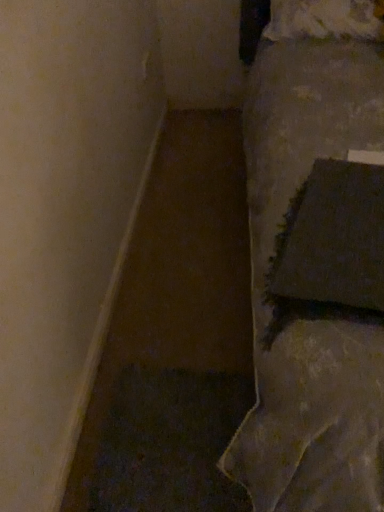
Question: Are white fluffy pillow at upper right, marked as the second pillow in a bottom-to-top arrangement, and dark fabric pillow at right, marked as the 1th pillow in a bottom-to-top arrangement, far apart?

Choices:
 (A) yes
 (B) no

Answer: (A)

Question: Is white fluffy pillow at upper right, which ranks as the 1th pillow in back-to-front order, positioned with its back to dark fabric pillow at right, the first pillow in the front-to-back sequence?

Choices:
 (A) no
 (B) yes

Answer: (A)

Question: Does white fluffy pillow at upper right, the 1th pillow positioned from the top, come behind dark fabric pillow at right, the second pillow in the back-to-front sequence?

Choices:
 (A) yes
 (B) no

Answer: (A)

Question: Is white fluffy pillow at upper right, the 1th pillow positioned from the top, aimed at dark fabric pillow at right, marked as the 1th pillow in a bottom-to-top arrangement?

Choices:
 (A) yes
 (B) no

Answer: (A)

Question: Considering the relative sizes of white fluffy pillow at upper right, which is the second pillow from front to back, and dark fabric pillow at right, marked as the 1th pillow in a bottom-to-top arrangement, in the image provided, is white fluffy pillow at upper right, which is the second pillow from front to back, bigger than dark fabric pillow at right, marked as the 1th pillow in a bottom-to-top arrangement,?

Choices:
 (A) yes
 (B) no

Answer: (A)

Question: Is white fluffy pillow at upper right, the 1th pillow positioned from the top, at the left side of dark fabric pillow at right, marked as the 1th pillow in a bottom-to-top arrangement?

Choices:
 (A) yes
 (B) no

Answer: (B)

Question: Is dark fabric pillow at right, marked as the 1th pillow in a bottom-to-top arrangement, thinner than white fluffy pillow at upper right, which is the second pillow from front to back?

Choices:
 (A) yes
 (B) no

Answer: (B)

Question: Does dark fabric pillow at right, marked as the 1th pillow in a bottom-to-top arrangement, lie behind white fluffy pillow at upper right, which ranks as the 1th pillow in back-to-front order?

Choices:
 (A) yes
 (B) no

Answer: (B)

Question: From the image's perspective, is dark fabric pillow at right, marked as the 1th pillow in a bottom-to-top arrangement, under white fluffy pillow at upper right, marked as the second pillow in a bottom-to-top arrangement?

Choices:
 (A) yes
 (B) no

Answer: (A)

Question: Does dark fabric pillow at right, marked as the 1th pillow in a bottom-to-top arrangement, have a lesser height compared to white fluffy pillow at upper right, which ranks as the 1th pillow in back-to-front order?

Choices:
 (A) yes
 (B) no

Answer: (A)

Question: Is the position of dark fabric pillow at right, the 2th pillow when ordered from top to bottom, less distant than that of white fluffy pillow at upper right, which is the second pillow from front to back?

Choices:
 (A) yes
 (B) no

Answer: (A)

Question: Does dark fabric pillow at right, the second pillow in the back-to-front sequence, have a larger size compared to white fluffy pillow at upper right, which ranks as the 1th pillow in back-to-front order?

Choices:
 (A) yes
 (B) no

Answer: (B)

Question: From a real-world perspective, is dark fabric pillow at right, the first pillow in the front-to-back sequence, physically located above or below white fluffy pillow at upper right, which ranks as the 1th pillow in back-to-front order?

Choices:
 (A) above
 (B) below

Answer: (B)